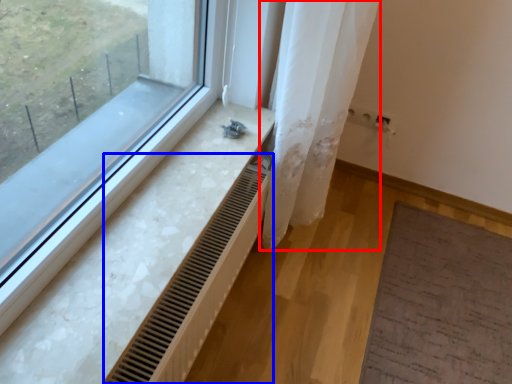
Question: Which of the following is the closest to the observer, shower curtain (highlighted by a red box) or radiator (highlighted by a blue box)?

Choices:
 (A) shower curtain
 (B) radiator

Answer: (B)